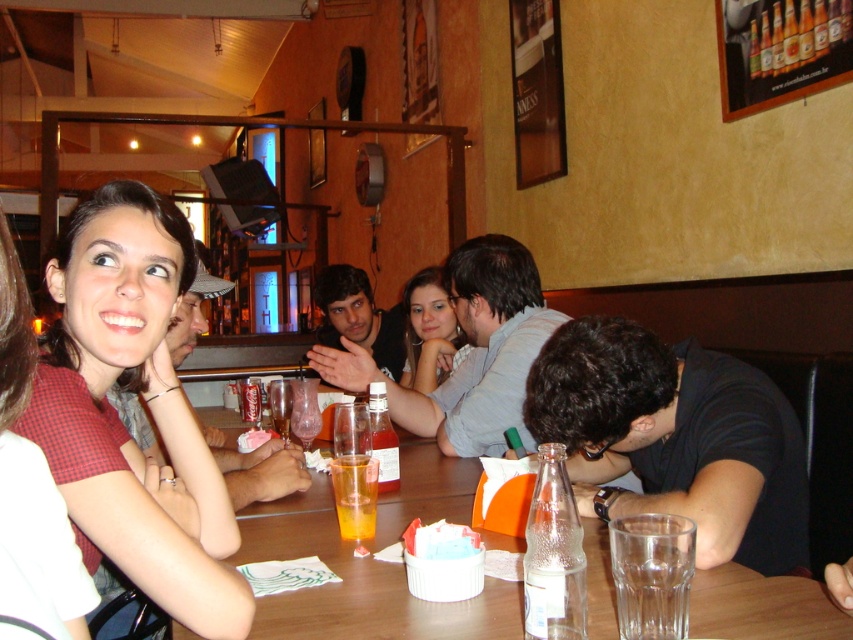
You are a waiter in a restaurant and need to deliver a drink to the customer wearing the matte red shirt at center. The wooden table at center has limited space. Can you place the drink directly in front of the customer without moving any existing items?

The matte red shirt at center is in front of the wooden table at center, so placing the drink directly in front of the customer would require space on the table. However, since the table is cluttered with items, there might not be enough space. Check the table for available space before placing the drink.

You are a waiter in a restaurant and need to place a new order at the table. The customer wants their drink placed at the exact location of point (173, 266). However, there is already an item at point (604, 621). Is the existing item blocking the new drink placement location?

Point (173, 266) is behind point (604, 621), so the existing item at point (604, 621) is blocking the new drink placement location at point (173, 266).